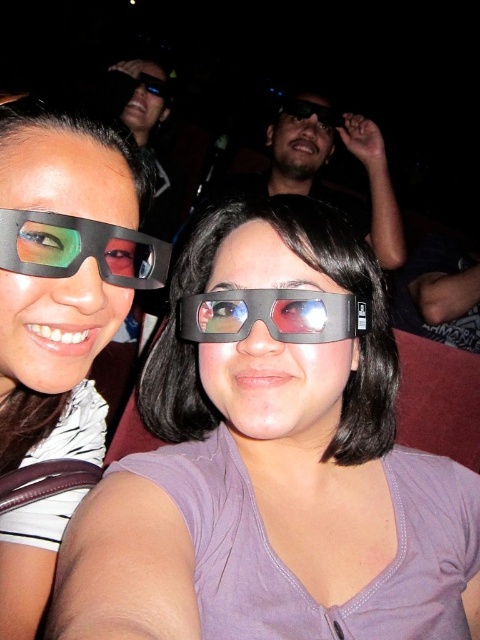
Question: Which of these objects is positioned closest to the matte black glasses at center?

Choices:
 (A) matte black goggles at center
 (B) matte black 3d glasses at center
 (C) matte black glasses at upper center
 (D) matte black glasses at left

Answer: (A)

Question: Does matte black glasses at left lie in front of matte black glasses at upper center?

Choices:
 (A) yes
 (B) no

Answer: (A)

Question: Can you confirm if matte black glasses at left is positioned to the left of matte black glasses at upper center?

Choices:
 (A) yes
 (B) no

Answer: (A)

Question: Is the position of matte black glasses at left more distant than that of matte black 3d glasses at center?

Choices:
 (A) no
 (B) yes

Answer: (B)

Question: Among these points, which one is farthest from the camera?

Choices:
 (A) (1, 449)
 (B) (299, 97)
 (C) (254, 579)

Answer: (B)

Question: Which point is closer to the camera taking this photo?

Choices:
 (A) (286, 109)
 (B) (231, 326)
 (C) (32, 248)

Answer: (C)